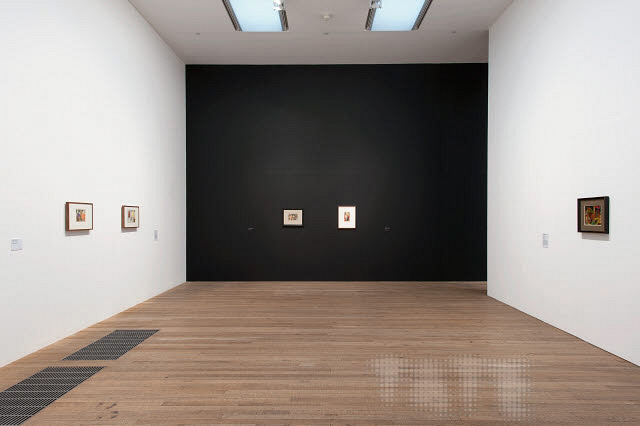
Where is `1 picture frame on the right wall`? 1 picture frame on the right wall is located at coordinates point(598,228).